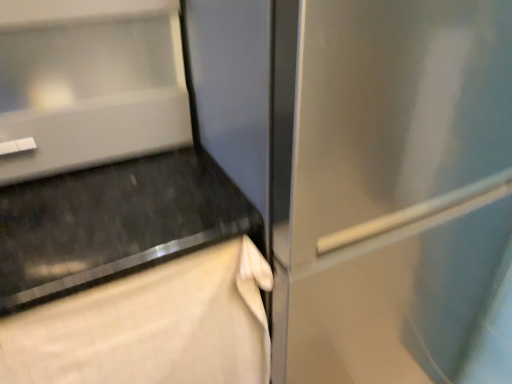
Locate an element on the screen. empty space that is ontop of black granite countertop at lower left (from a real-world perspective) is located at coordinates (98, 235).